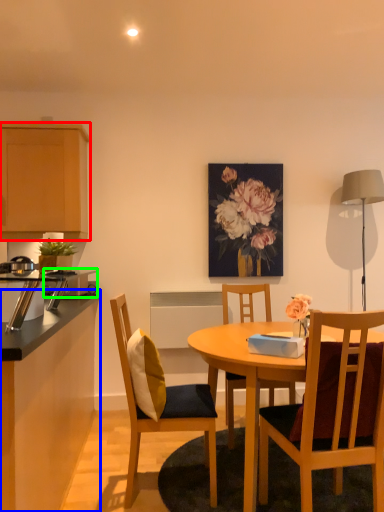
Question: Which is farther away from cabinetry (highlighted by a red box)? cabinetry (highlighted by a blue box) or appliance (highlighted by a green box)?

Choices:
 (A) cabinetry
 (B) appliance

Answer: (A)